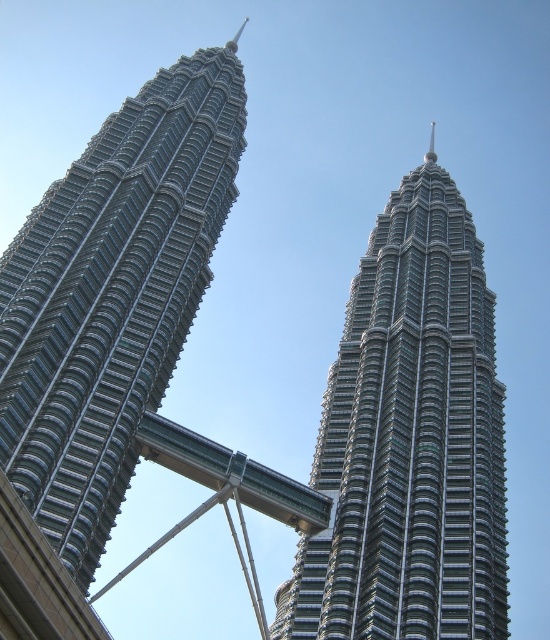
Is metallic glass skyscraper at center wider than shiny metallic skyscraper at center?

Yes, metallic glass skyscraper at center is wider than shiny metallic skyscraper at center.

Find the location of a particular element. This screenshot has height=640, width=550. metallic glass skyscraper at center is located at coordinates (409, 440).